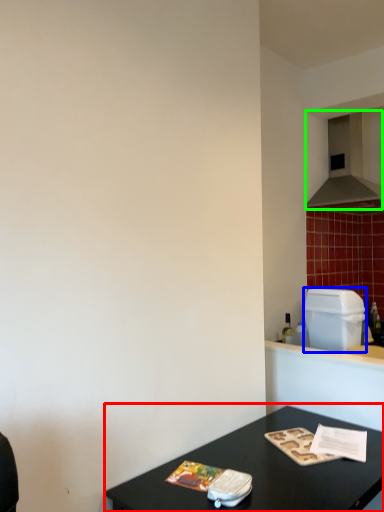
Question: Which object is the closest to the table (highlighted by a red box)? Choose among these: appliance (highlighted by a blue box) or exhaust hood (highlighted by a green box).

Choices:
 (A) appliance
 (B) exhaust hood

Answer: (A)